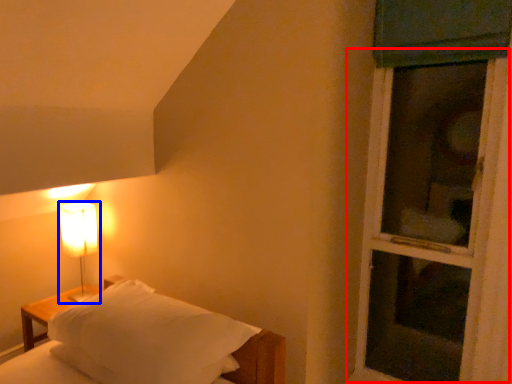
Question: Which of the following is the closest to the observer, screen door (highlighted by a red box) or lamp (highlighted by a blue box)?

Choices:
 (A) screen door
 (B) lamp

Answer: (A)